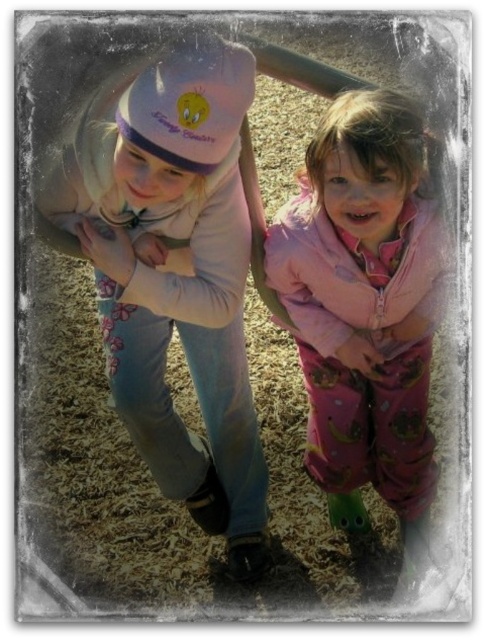
You are a photographer trying to capture a photo of the two children in the scene. You notice the pink fleece sweater at upper center and the pink fleece jacket at center. Which clothing item should you focus on first if you want to photograph the one that is higher up?

The pink fleece sweater at upper center is located above the pink fleece jacket at center, so you should focus on the pink fleece sweater at upper center first to capture the higher one.

You are a photographer trying to capture a clear photo of both the pink fleece sweater at upper center and the pink fleece jacket at center. Since the camera can only focus on one object at a time, which one should you focus on to ensure the other is still somewhat visible in the background?

You should focus on the pink fleece sweater at upper center because it is in front of the pink fleece jacket at center, so if you focus on the sweater, the jacket will be in the background and still somewhat visible.

You are standing in front of the swing set and see two points marked on the swing set. The first point is at coordinates point (243, 253) and the second is at point (360, 205). Which point is closer to you?

Point (243, 253) is further to the camera than point (360, 205), so the closer point to you is point (360, 205).